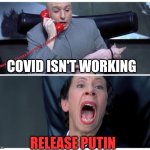
Find the location of a particular element. Image resolution: width=150 pixels, height=150 pixels. chair is located at coordinates (104, 25).